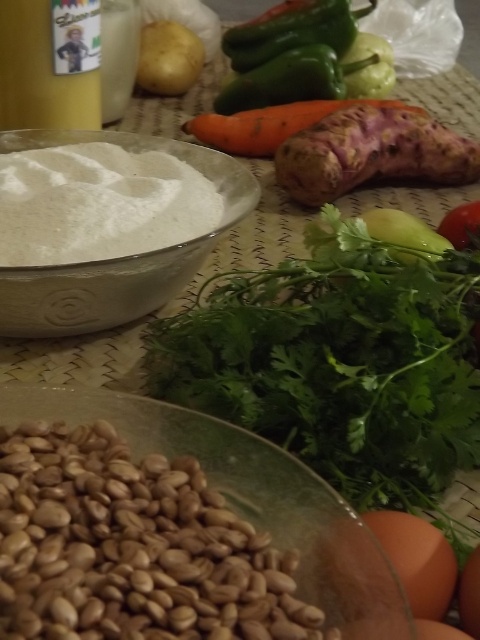
You are a chef preparing a recipe that requires both the white powder at center and the green matte pepper at upper center. You need to grab them quickly. Which one should you reach for first if you are standing to the right of both objects?

Since the white powder at center is to the left of the green matte pepper at upper center, you should reach for the white powder at center first as it is closer to your right side.

Based on the scene description, where is the smooth yellow liquid at upper left located in terms of coordinates?

The smooth yellow liquid at upper left is located at coordinates point (49, 64).